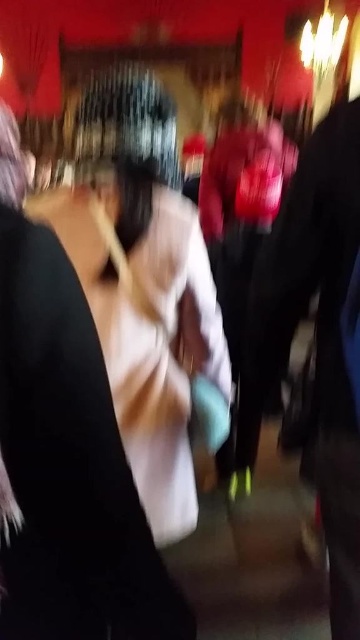
Is light beige fabric bag at center to the left of dark gray fabric jacket at right from the viewer's perspective?

Correct, you'll find light beige fabric bag at center to the left of dark gray fabric jacket at right.

Is point (164, 140) more distant than point (263, 314)?

That is True.

Locate an element on the screen. The width and height of the screenshot is (360, 640). light beige fabric bag at center is located at coordinates (144, 285).

Does matte white dress at left lie in front of light beige fabric bag at center?

Yes, matte white dress at left is in front of light beige fabric bag at center.

Between matte white dress at left and light beige fabric bag at center, which one has more height?

light beige fabric bag at center

Which is behind, point (51, 557) or point (86, 116)?

The point (86, 116) is more distant.

Locate an element on the screen. Image resolution: width=360 pixels, height=640 pixels. matte white dress at left is located at coordinates (69, 465).

Find the location of a particular element. This screenshot has height=640, width=360. matte white dress at left is located at coordinates (69, 465).

Between point (68, 522) and point (336, 243), which one is positioned in front?

Point (68, 522) is more forward.

Locate an element on the screen. The height and width of the screenshot is (640, 360). matte white dress at left is located at coordinates (69, 465).